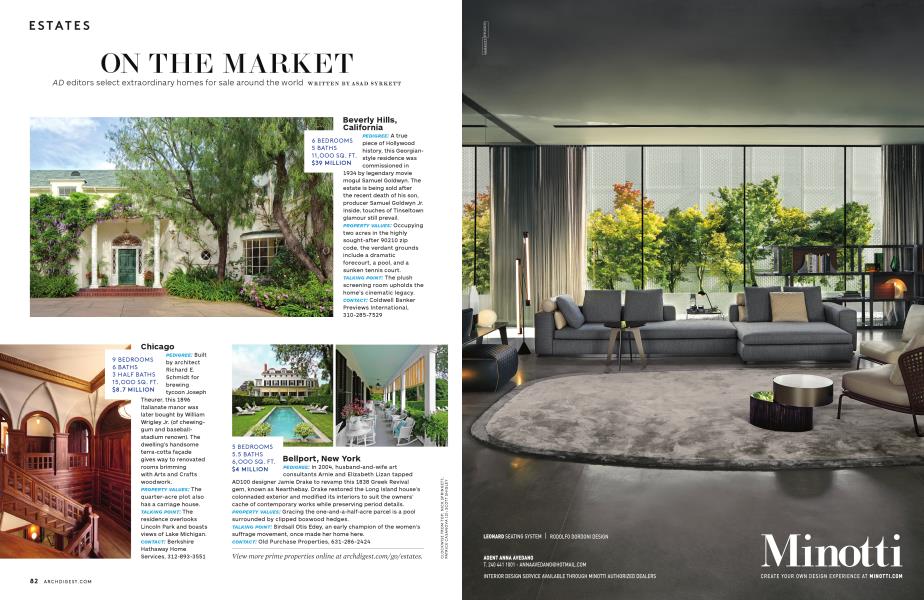
Find the location of a particular element. The height and width of the screenshot is (600, 924). ceiling is located at coordinates (652, 58).